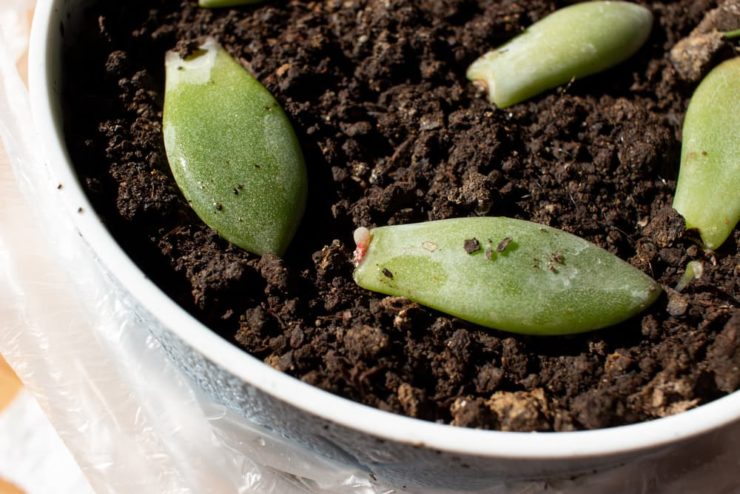
Where is `leftmost succulent`? This screenshot has height=494, width=740. leftmost succulent is located at coordinates (192, 154).